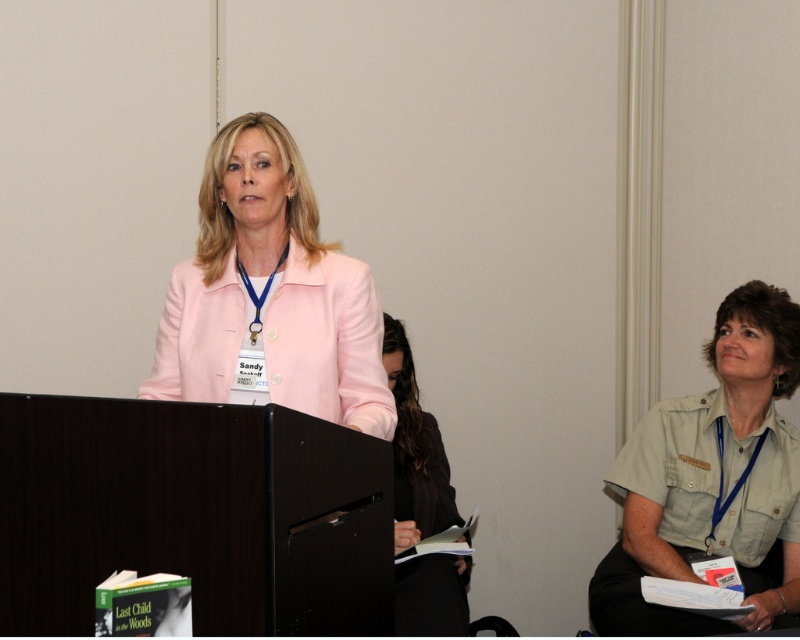
Between khaki uniform at right and black leather jacket at center, which one appears on the right side from the viewer's perspective?

Positioned to the right is khaki uniform at right.

Does point (640, 538) come behind point (405, 540)?

Yes, point (640, 538) is behind point (405, 540).

Does point (784, 531) lie behind point (450, 630)?

Yes, it is.

What are the coordinates of `khaki uniform at right` in the screenshot? It's located at (712, 481).

Between pink fabric jacket at center and black leather jacket at center, which one has more height?

With more height is black leather jacket at center.

In the scene shown: Can you confirm if pink fabric jacket at center is wider than black leather jacket at center?

Indeed, pink fabric jacket at center has a greater width compared to black leather jacket at center.

The width and height of the screenshot is (800, 640). What do you see at coordinates (270, 296) in the screenshot?
I see `pink fabric jacket at center` at bounding box center [270, 296].

Where is `pink fabric jacket at center`? pink fabric jacket at center is located at coordinates (270, 296).

Can you confirm if pink fabric jacket at center is positioned below khaki uniform at right?

No.

Is pink fabric jacket at center smaller than khaki uniform at right?

Indeed, pink fabric jacket at center has a smaller size compared to khaki uniform at right.

Where is `pink fabric jacket at center`? pink fabric jacket at center is located at coordinates (270, 296).

Locate an element on the screen. The image size is (800, 640). pink fabric jacket at center is located at coordinates (270, 296).